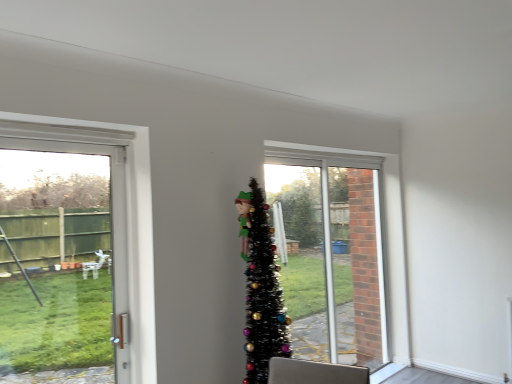
Question: Does white plastic door at left have a lesser height compared to black tinsel christmas tree at center?

Choices:
 (A) yes
 (B) no

Answer: (B)

Question: From a real-world perspective, is white plastic door at left positioned over black tinsel christmas tree at center based on gravity?

Choices:
 (A) yes
 (B) no

Answer: (A)

Question: From a real-world perspective, does white plastic door at left sit lower than black tinsel christmas tree at center?

Choices:
 (A) yes
 (B) no

Answer: (B)

Question: From the image's perspective, is white plastic door at left below black tinsel christmas tree at center?

Choices:
 (A) yes
 (B) no

Answer: (B)

Question: Does white plastic door at left come behind black tinsel christmas tree at center?

Choices:
 (A) yes
 (B) no

Answer: (B)

Question: Is clear glass window at center situated inside black tinsel christmas tree at center or outside?

Choices:
 (A) inside
 (B) outside

Answer: (B)

Question: Relative to black tinsel christmas tree at center, is clear glass window at center in front or behind?

Choices:
 (A) front
 (B) behind

Answer: (B)

Question: From the image's perspective, is clear glass window at center located above or below black tinsel christmas tree at center?

Choices:
 (A) below
 (B) above

Answer: (A)

Question: From a real-world perspective, relative to black tinsel christmas tree at center, is clear glass window at center vertically above or below?

Choices:
 (A) below
 (B) above

Answer: (A)

Question: Does point (76, 307) appear closer or farther from the camera than point (345, 306)?

Choices:
 (A) farther
 (B) closer

Answer: (B)

Question: From a real-world perspective, relative to clear glass window at center, is white plastic door at left vertically above or below?

Choices:
 (A) below
 (B) above

Answer: (B)

Question: Is white plastic door at left situated inside clear glass window at center or outside?

Choices:
 (A) outside
 (B) inside

Answer: (A)

Question: Is white plastic door at left bigger or smaller than clear glass window at center?

Choices:
 (A) big
 (B) small

Answer: (B)

Question: Looking at their shapes, would you say clear glass window at center is wider or thinner than white plastic door at left?

Choices:
 (A) thin
 (B) wide

Answer: (A)

Question: Is clear glass window at center to the left or to the right of white plastic door at left in the image?

Choices:
 (A) right
 (B) left

Answer: (A)